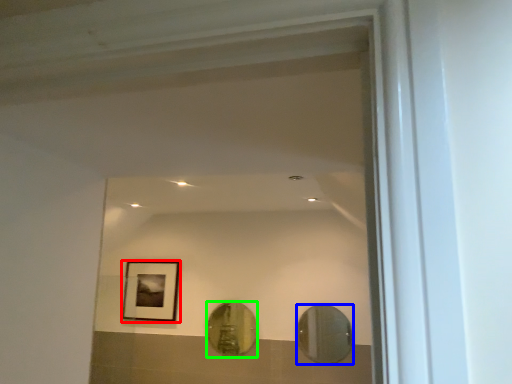
Question: Which object is positioned farthest from picture frame (highlighted by a red box)? Select from mirror (highlighted by a blue box) and mirror (highlighted by a green box).

Choices:
 (A) mirror
 (B) mirror

Answer: (A)